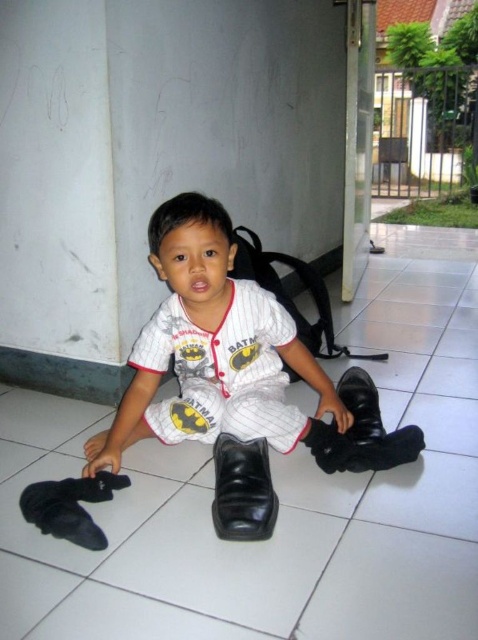
Does matte black shoes at center have a smaller size compared to white fabric baseball uniform at center?

No, matte black shoes at center is not smaller than white fabric baseball uniform at center.

Does point (319, 442) come farther from viewer compared to point (242, 362)?

No, (319, 442) is in front of (242, 362).

Does point (286, 424) come behind point (279, 387)?

No.

You are a GUI agent. You are given a task and a screenshot of the screen. Output one action in this format:
    pyautogui.click(x=<x>, y=<y>)
    Task: Click on the matte black shoes at center
    The width and height of the screenshot is (478, 640).
    Given the screenshot: What is the action you would take?
    pyautogui.click(x=236, y=376)

Can you confirm if black leather boot at lower center is shorter than black leather shoe at center?

No.

Is point (359, 385) positioned in front of point (252, 540)?

That is False.

Find the location of a particular element. The image size is (478, 640). black leather boot at lower center is located at coordinates (361, 433).

Between matte black shoes at center and black leather boot at lower center, which one appears on the left side from the viewer's perspective?

matte black shoes at center is more to the left.

Does matte black shoes at center appear on the left side of black leather boot at lower center?

Yes, matte black shoes at center is to the left of black leather boot at lower center.

You are a GUI agent. You are given a task and a screenshot of the screen. Output one action in this format:
    pyautogui.click(x=<x>, y=<y>)
    Task: Click on the matte black shoes at center
    The width and height of the screenshot is (478, 640).
    Given the screenshot: What is the action you would take?
    pyautogui.click(x=236, y=376)

The image size is (478, 640). What are the coordinates of `matte black shoes at center` in the screenshot? It's located at (236, 376).